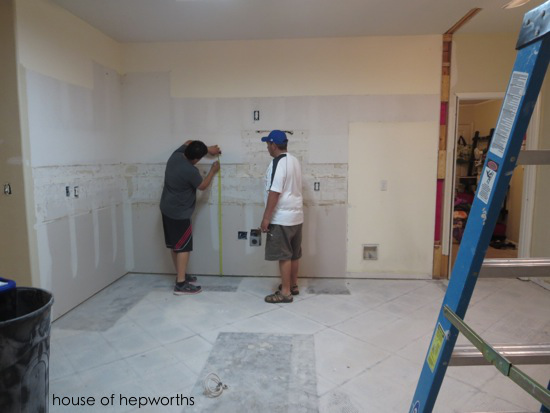
Image resolution: width=550 pixels, height=413 pixels. I want to click on garbage can, so click(x=42, y=313).